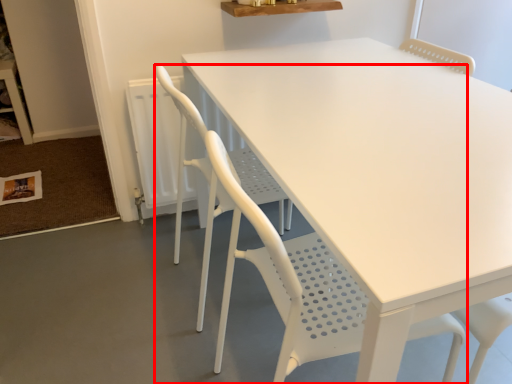
Question: From the image, what is the correct spatial relationship of chair (annotated by the red box) in relation to chair?

Choices:
 (A) left
 (B) right

Answer: (B)